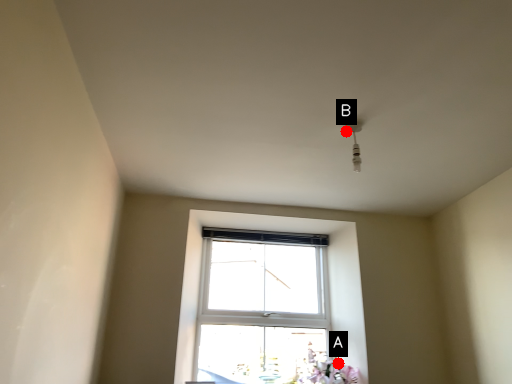
Question: Two points are circled on the image, labeled by A and B beside each circle. Which of the following is the farthest from the observer?

Choices:
 (A) A is further
 (B) B is further

Answer: (A)